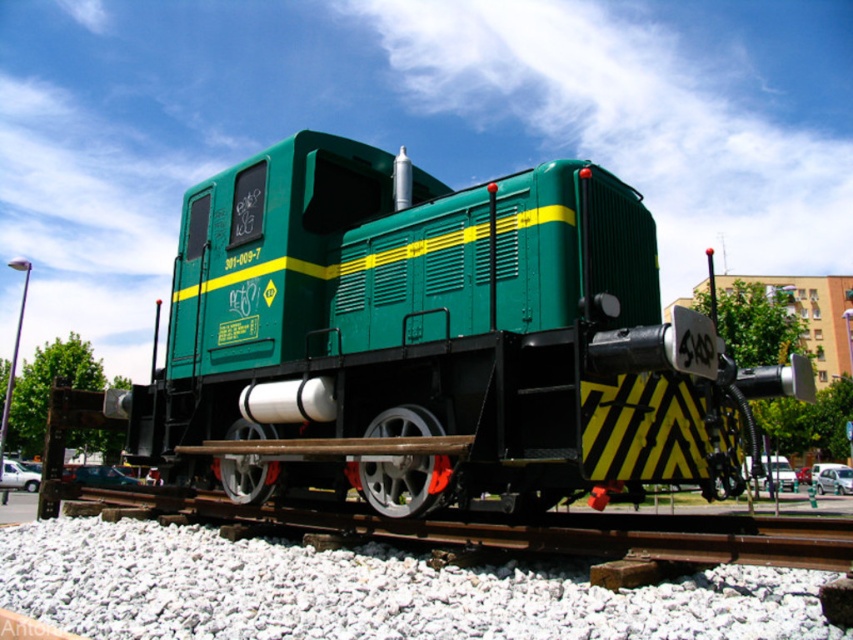
Question: In this image, where is green matte train at center located relative to smooth metal train track at center?

Choices:
 (A) left
 (B) right

Answer: (A)

Question: Does white gravel at lower center appear over smooth metal train track at center?

Choices:
 (A) no
 (B) yes

Answer: (A)

Question: Where is green matte train at center located in relation to smooth metal train track at center in the image?

Choices:
 (A) right
 (B) left

Answer: (B)

Question: Which object appears farthest from the camera in this image?

Choices:
 (A) smooth metal train track at center
 (B) white gravel at lower center
 (C) green matte train at center

Answer: (C)

Question: Which object is the farthest from the green matte train at center?

Choices:
 (A) smooth metal train track at center
 (B) white gravel at lower center

Answer: (A)

Question: Which of the following is the farthest from the observer?

Choices:
 (A) white gravel at lower center
 (B) green matte train at center

Answer: (B)